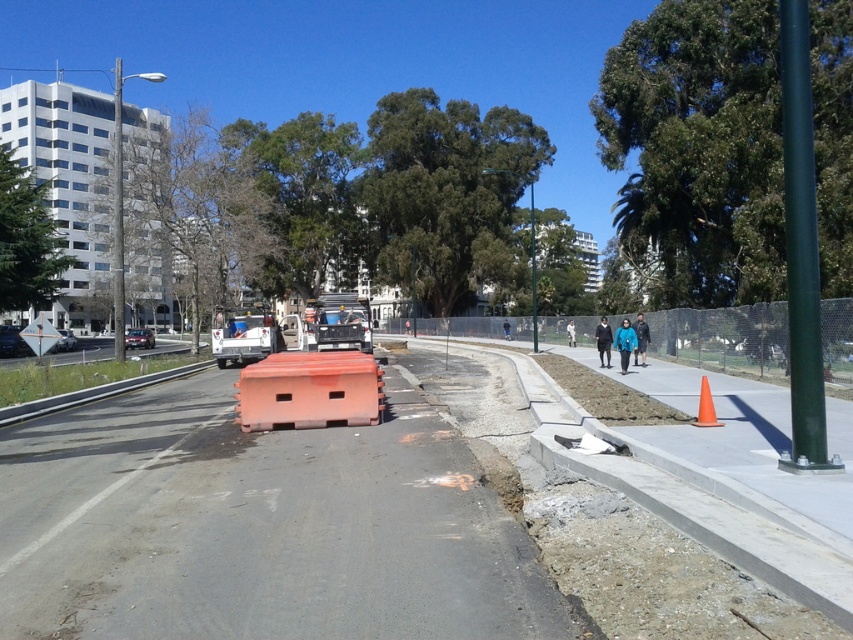
Question: Does orange plastic barricade at center have a greater width compared to brushed metal highway at lower left?

Choices:
 (A) yes
 (B) no

Answer: (B)

Question: Which point appears closest to the camera in this image?

Choices:
 (A) (74, 525)
 (B) (97, 349)

Answer: (A)

Question: Which object is farther from the camera taking this photo?

Choices:
 (A) brushed metal highway at lower left
 (B) orange matte traffic cone at right
 (C) orange plastic barricade at center

Answer: (A)

Question: Can you confirm if brushed metal highway at lower left is thinner than orange matte traffic cone at right?

Choices:
 (A) no
 (B) yes

Answer: (A)

Question: Which object is the closest to the orange plastic barricade at center?

Choices:
 (A) brushed metal highway at lower left
 (B) orange matte traffic cone at right
 (C) orange plastic barrier at center

Answer: (C)

Question: Does brushed metal highway at lower left appear on the left side of orange matte traffic cone at right?

Choices:
 (A) yes
 (B) no

Answer: (A)